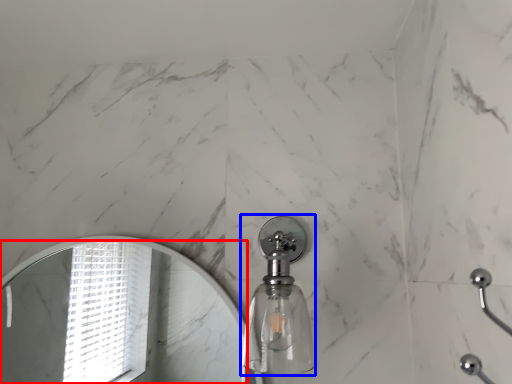
Question: Among these objects, which one is farthest to the camera, mirror (highlighted by a red box) or soap dispenser (highlighted by a blue box)?

Choices:
 (A) mirror
 (B) soap dispenser

Answer: (A)